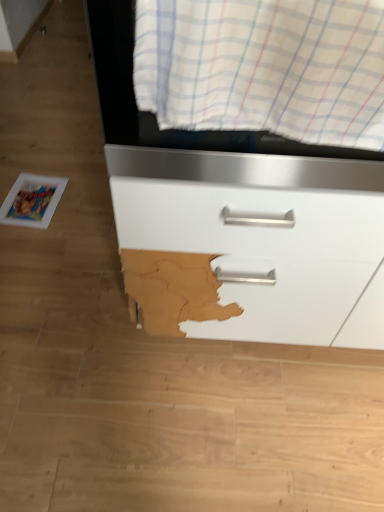
Question: Is white glossy magazine at lower left closer to camera compared to matte white drawer at center?

Choices:
 (A) no
 (B) yes

Answer: (A)

Question: From a real-world perspective, is white glossy magazine at lower left physically above matte white drawer at center?

Choices:
 (A) yes
 (B) no

Answer: (B)

Question: Considering the relative positions of white glossy magazine at lower left and matte white drawer at center in the image provided, is white glossy magazine at lower left behind matte white drawer at center?

Choices:
 (A) yes
 (B) no

Answer: (A)

Question: Does white glossy magazine at lower left turn towards matte white drawer at center?

Choices:
 (A) yes
 (B) no

Answer: (B)

Question: Considering the relative positions of white glossy magazine at lower left and matte white drawer at center in the image provided, is white glossy magazine at lower left to the right of matte white drawer at center from the viewer's perspective?

Choices:
 (A) no
 (B) yes

Answer: (A)

Question: Is white glossy magazine at lower left not close to matte white drawer at center?

Choices:
 (A) no
 (B) yes

Answer: (A)

Question: From the image's perspective, is white striped fabric at upper center over white glossy magazine at lower left?

Choices:
 (A) no
 (B) yes

Answer: (B)

Question: Is white striped fabric at upper center positioned behind white glossy magazine at lower left?

Choices:
 (A) yes
 (B) no

Answer: (B)

Question: Is white striped fabric at upper center taller than white glossy magazine at lower left?

Choices:
 (A) no
 (B) yes

Answer: (B)

Question: Considering the relative positions of white striped fabric at upper center and white glossy magazine at lower left in the image provided, is white striped fabric at upper center to the right of white glossy magazine at lower left from the viewer's perspective?

Choices:
 (A) yes
 (B) no

Answer: (A)

Question: Is white striped fabric at upper center surrounding white glossy magazine at lower left?

Choices:
 (A) no
 (B) yes

Answer: (A)

Question: Is white striped fabric at upper center positioned with its back to white glossy magazine at lower left?

Choices:
 (A) yes
 (B) no

Answer: (B)

Question: From a real-world perspective, does matte white drawer at center stand above white striped fabric at upper center?

Choices:
 (A) no
 (B) yes

Answer: (A)